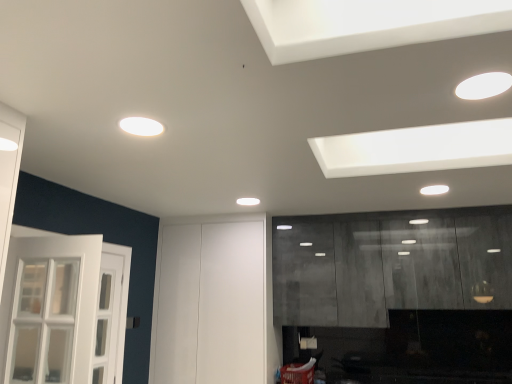
Question: Can you confirm if white glossy light fixture at upper right, the second lighting viewed from the back, is shorter than matte gray cabinetry at right?

Choices:
 (A) yes
 (B) no

Answer: (A)

Question: Considering the relative sizes of white glossy light fixture at upper right, the 1th lighting when ordered from right to left, and matte gray cabinetry at right in the image provided, is white glossy light fixture at upper right, the 1th lighting when ordered from right to left, thinner than matte gray cabinetry at right?

Choices:
 (A) yes
 (B) no

Answer: (A)

Question: Is white glossy light fixture at upper right, acting as the 2th lighting starting from the left, bigger than matte gray cabinetry at right?

Choices:
 (A) yes
 (B) no

Answer: (B)

Question: From a real-world perspective, is white glossy light fixture at upper right, which is the 2th lighting from bottom to top, positioned over matte gray cabinetry at right based on gravity?

Choices:
 (A) yes
 (B) no

Answer: (A)

Question: Is white glossy light fixture at upper right, the 1th lighting from the front, looking in the opposite direction of matte gray cabinetry at right?

Choices:
 (A) no
 (B) yes

Answer: (A)

Question: In terms of size, does white matte light fixture at upper center, marked as the second lighting in a front-to-back arrangement, appear bigger or smaller than white glossy light fixture at upper right, the second lighting viewed from the back?

Choices:
 (A) small
 (B) big

Answer: (A)

Question: Is white matte light fixture at upper center, which is the 1th lighting in bottom-to-top order, in front of or behind white glossy light fixture at upper right, acting as the 2th lighting starting from the left, in the image?

Choices:
 (A) front
 (B) behind

Answer: (B)

Question: In the image, is white matte light fixture at upper center, which is the 1th lighting in bottom-to-top order, on the left side or the right side of white glossy light fixture at upper right, which is the 2th lighting from bottom to top?

Choices:
 (A) left
 (B) right

Answer: (A)

Question: Is white matte light fixture at upper center, which is the 1th lighting in bottom-to-top order, situated inside white glossy light fixture at upper right, the 1th lighting when ordered from right to left, or outside?

Choices:
 (A) outside
 (B) inside

Answer: (A)

Question: Is point (306, 289) positioned closer to the camera than point (168, 240)?

Choices:
 (A) farther
 (B) closer

Answer: (B)

Question: From the image's perspective, is matte gray cabinetry at right located above or below white matte door at center?

Choices:
 (A) below
 (B) above

Answer: (B)

Question: Is matte gray cabinetry at right bigger or smaller than white matte door at center?

Choices:
 (A) big
 (B) small

Answer: (B)

Question: In terms of height, does matte gray cabinetry at right look taller or shorter compared to white matte door at center?

Choices:
 (A) tall
 (B) short

Answer: (B)

Question: Considering their positions, is white glossy light fixture at upper right, the 1th lighting when ordered from right to left, located in front of or behind matte gray cabinetry at right?

Choices:
 (A) behind
 (B) front

Answer: (B)

Question: From the image's perspective, is white glossy light fixture at upper right, the second lighting viewed from the back, located above or below matte gray cabinetry at right?

Choices:
 (A) below
 (B) above

Answer: (B)